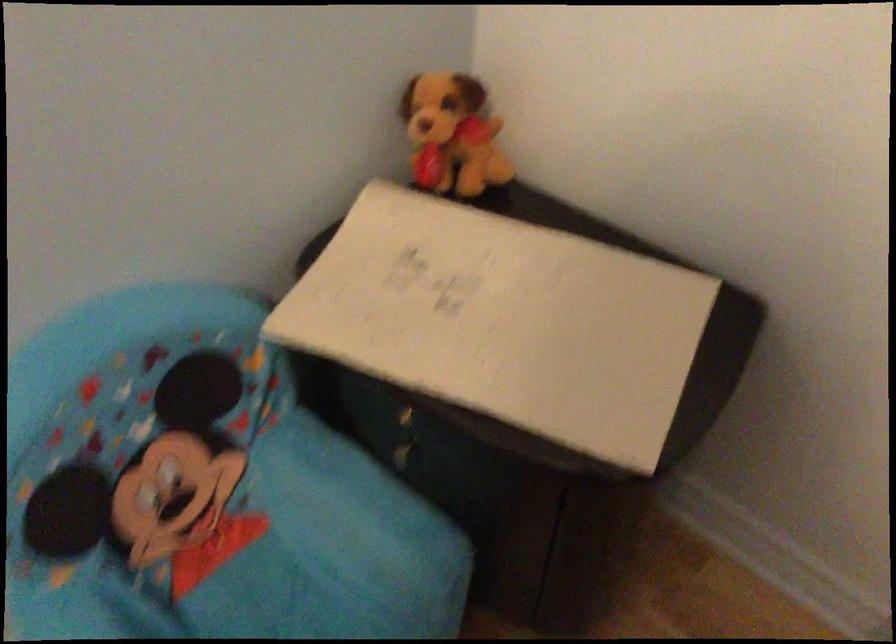
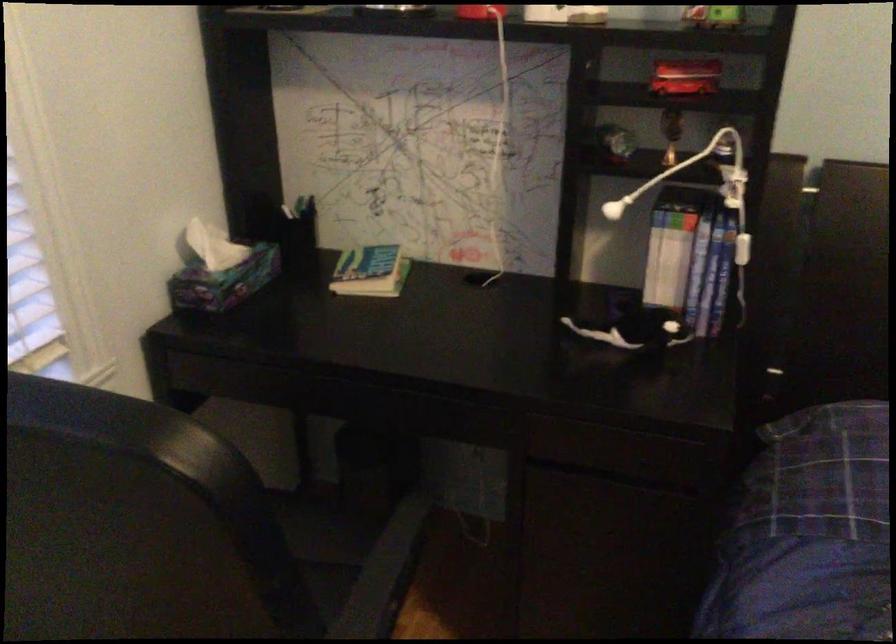
How did the camera likely rotate?

The camera rotated toward right-down.